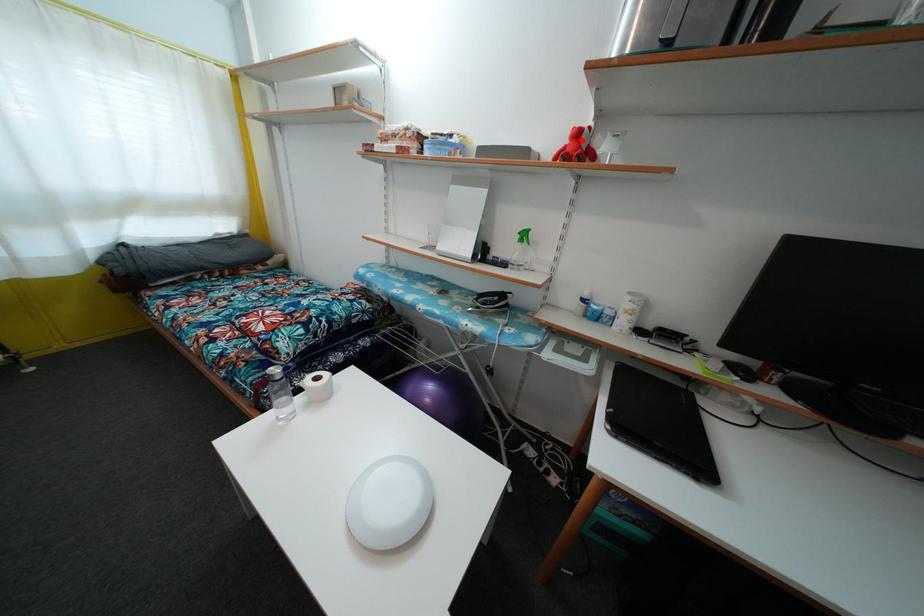
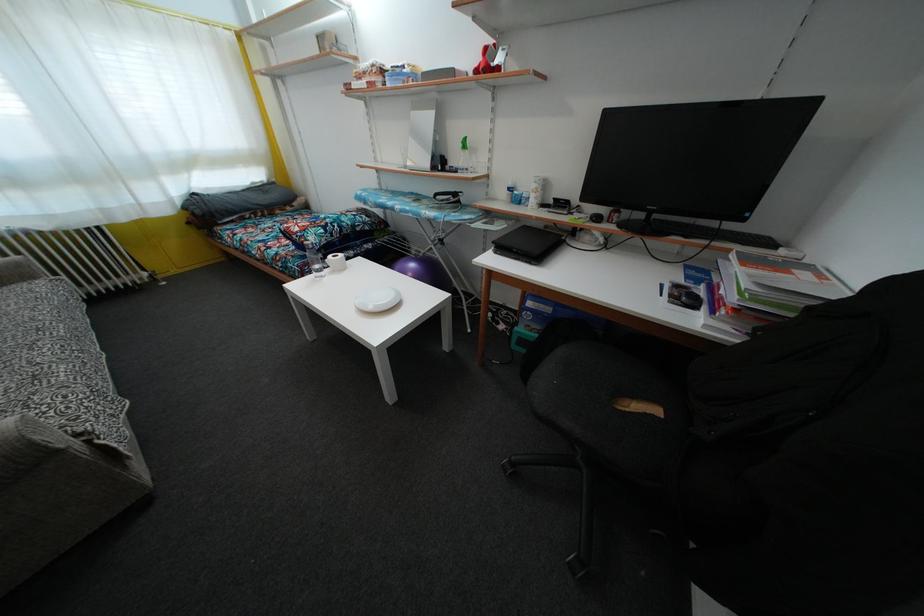
The point at the highlighted location is marked in the first image. Where is the corresponding point in the second image?

(490, 58)